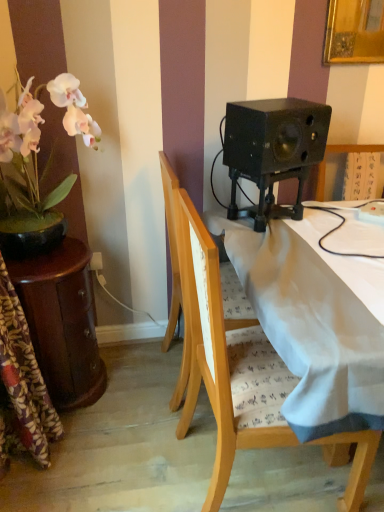
Find the location of a particular element. vacant area located to the right-hand side of mahogany wooden side table at left is located at coordinates (138, 390).